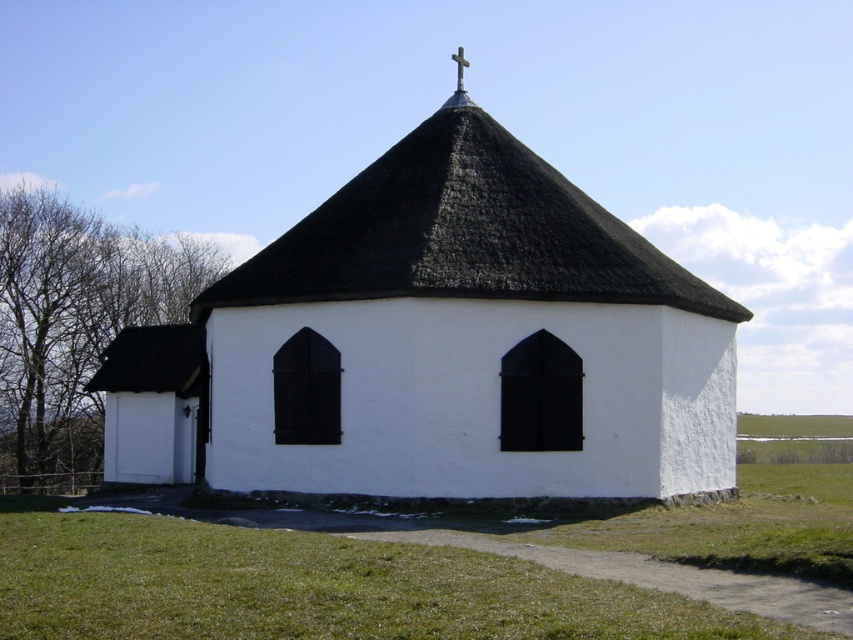
Between white matte church at center and thatched roof at center, which one is positioned lower?

white matte church at center is lower down.

Is white matte church at center below thatched roof at center?

Yes, white matte church at center is below thatched roof at center.

Where is `white matte church at center`? white matte church at center is located at coordinates (442, 346).

Which is in front, point (177, 616) or point (451, 97)?

Point (177, 616) is more forward.

Does green grass at lower center have a lesser height compared to metallic cross at upper center?

Yes, green grass at lower center is shorter than metallic cross at upper center.

This screenshot has height=640, width=853. Find the location of `green grass at lower center`. green grass at lower center is located at coordinates [x=308, y=586].

Which is behind, point (509, 576) or point (567, 240)?

Positioned behind is point (567, 240).

Does green grass at lower center have a greater height compared to thatched roof at center?

No.

What do you see at coordinates (308, 586) in the screenshot? I see `green grass at lower center` at bounding box center [308, 586].

You are a GUI agent. You are given a task and a screenshot of the screen. Output one action in this format:
    pyautogui.click(x=<x>, y=<y>)
    Task: Click on the green grass at lower center
    The width and height of the screenshot is (853, 640).
    Given the screenshot: What is the action you would take?
    pyautogui.click(x=308, y=586)